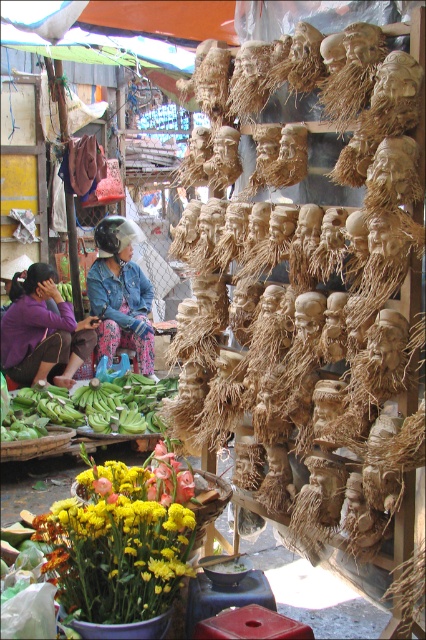
Question: Can you confirm if glossy yellow flowers at lower left is smaller than purple fabric at lower left?

Choices:
 (A) yes
 (B) no

Answer: (A)

Question: Which point appears closest to the camera in this image?

Choices:
 (A) (112, 420)
 (B) (144, 356)
 (C) (89, 534)
 (D) (23, 310)

Answer: (C)

Question: Estimate the real-world distances between objects in this image. Which object is closer to the purple fabric at lower left?

Choices:
 (A) denim jacket at center
 (B) green leafy bananas at lower left

Answer: (A)

Question: Which point is closer to the camera taking this photo?

Choices:
 (A) (62, 557)
 (B) (31, 308)
 (C) (117, 252)
 (D) (100, 404)

Answer: (A)

Question: Is purple fabric at lower left closer to camera compared to denim jacket at center?

Choices:
 (A) no
 (B) yes

Answer: (B)

Question: Considering the relative positions of purple fabric at lower left and denim jacket at center in the image provided, where is purple fabric at lower left located with respect to denim jacket at center?

Choices:
 (A) below
 (B) above

Answer: (A)